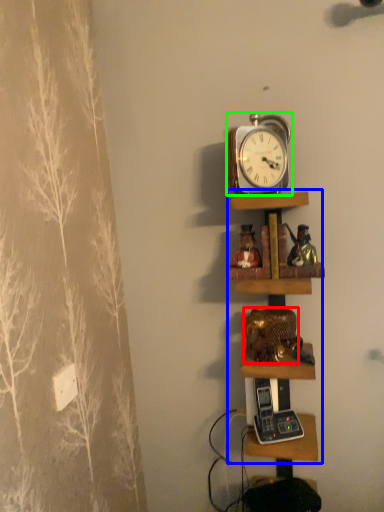
Question: Considering the real-world distances, which object is farthest from toy (highlighted by a red box)? shelf (highlighted by a blue box) or alarm clock (highlighted by a green box)?

Choices:
 (A) shelf
 (B) alarm clock

Answer: (B)